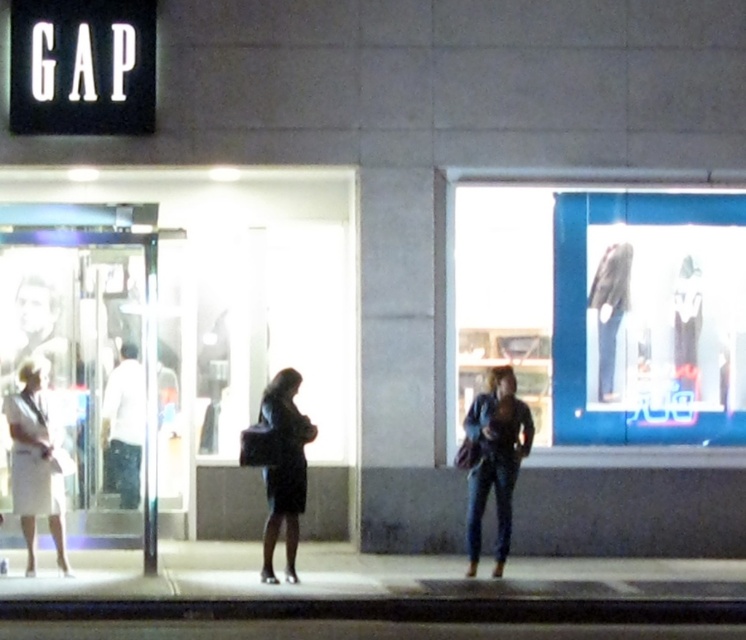
Question: Can you confirm if blue glass display at center is positioned to the left of denim jeans at center?

Choices:
 (A) no
 (B) yes

Answer: (A)

Question: Can you confirm if denim jeans at center is positioned below dark blue fabric coat at center?

Choices:
 (A) no
 (B) yes

Answer: (B)

Question: Based on their relative distances, which object is farther from the blue glass display at center?

Choices:
 (A) white matte skirt at left
 (B) dark blue fabric coat at center

Answer: (A)

Question: Does white matte skirt at left appear on the right side of dark blue fabric coat at center?

Choices:
 (A) no
 (B) yes

Answer: (A)

Question: Which point is closer to the camera?

Choices:
 (A) (19, 416)
 (B) (668, 285)
 (C) (300, 499)
 (D) (515, 440)

Answer: (C)

Question: Which of the following is the farthest from the observer?

Choices:
 (A) white matte skirt at left
 (B) dark blue fabric coat at center
 (C) blue glass display at center
 (D) denim jeans at center

Answer: (C)